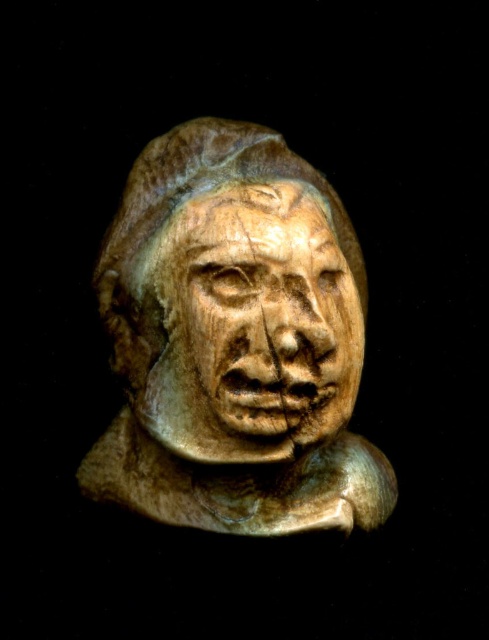
What is located at the coordinates point (236, 340) in the image?

The matte stone bust at center is located at point (236, 340).

You are an art restorer working on a sculpture. You have two items in front of you, the matte stone bust at center and the wooden carving at center. Your task is to determine which item is wider. Which one should you measure first to confirm?

The matte stone bust at center is wider than the wooden carving at center, so you should measure the matte stone bust at center first to confirm its width.

You are an art restorer examining a sculpture. You notice two elements at the center of the image, the matte stone bust at center and the wooden carving at center. Which one appears closer to you?

The matte stone bust at center appears closer to you than the wooden carving at center because it is further to the viewer.